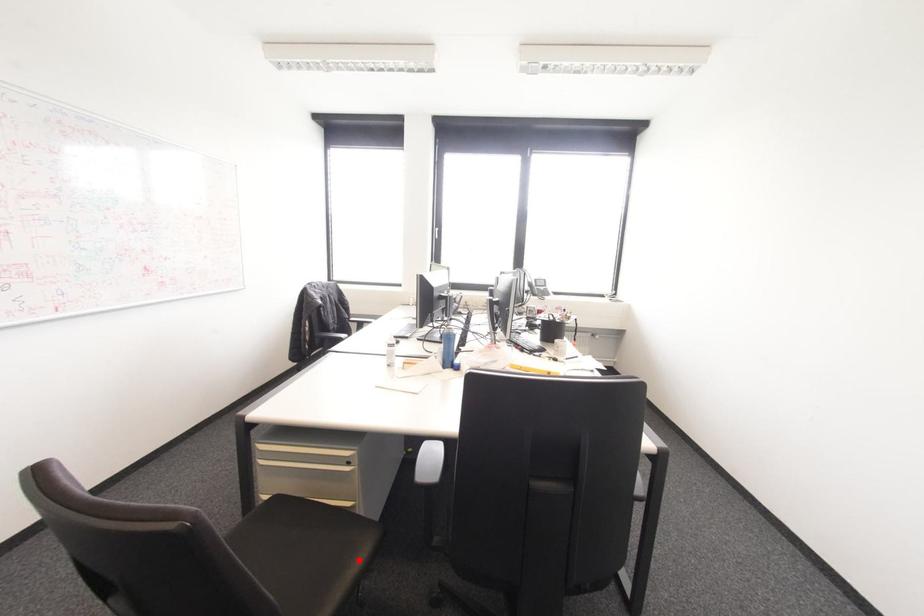
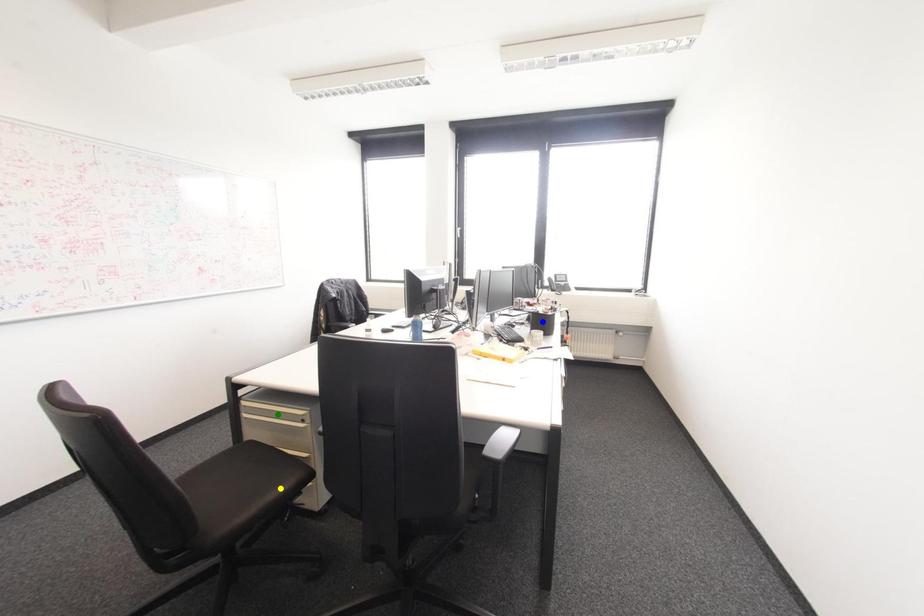
Question: I am providing you with two images of the same scene from different viewpoints. A red point is marked on the first image. You are given multiple points on the second image. Which spot in image 2 lines up with the point in image 1?

Choices:
 (A) blue point
 (B) green point
 (C) yellow point

Answer: (C)